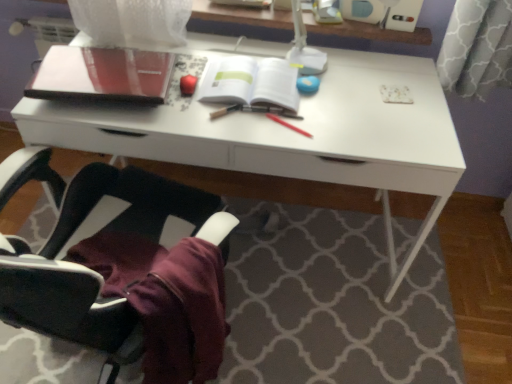
Locate an element on the screen. free location in front of red matte pen at center, positioned as the 3th stationery in left-to-right order is located at coordinates (292, 146).